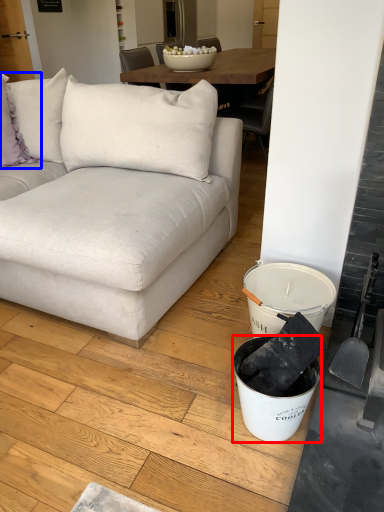
Question: Among these objects, which one is farthest to the camera, bucket (highlighted by a red box) or pillow (highlighted by a blue box)?

Choices:
 (A) bucket
 (B) pillow

Answer: (B)